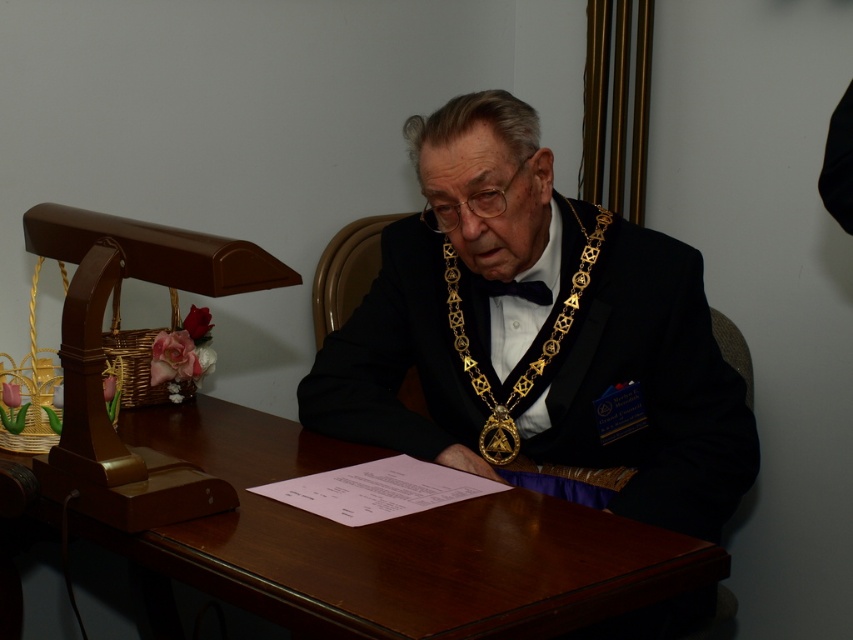
You are standing in front of the desk and want to place a small object on the black satin suit at center. Is the point at coordinates point (537, 332) the correct location to place it?

Yes, the black satin suit at center is represented by point (537, 332), so placing the object there would be accurate.

Where is the black satin suit at center located in the image?

The black satin suit at center is located at point 0.519 in the x coordinate and 0.631 in the y coordinate.

You are taking a photo of the scene and want to focus on both the point at (618, 300) and the point at (445, 280). Which point should you adjust your focus to first to ensure both are in clear view?

You should focus on point (445, 280) first because it is further from the camera compared to point (618, 300), allowing the depth of field to cover both points effectively.